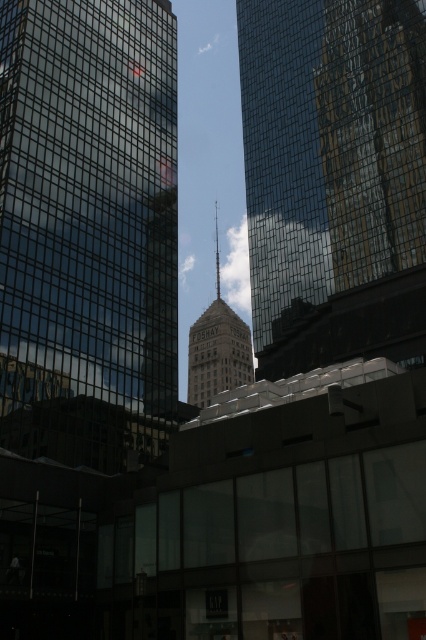
You are standing at the point closest to the camera in the cityscape. Which point, point [112,291] or point [313,24], are you standing at?

You are standing at point [112,291] because it is in front of point [313,24].

You are a city planner evaluating the layout of the cityscape. You need to determine the order of the transparent glass skyscraper at left and the matte glass tower at center from the viewer. Which one is positioned to the left?

The transparent glass skyscraper at left is positioned to the left of the matte glass tower at center according to the description.